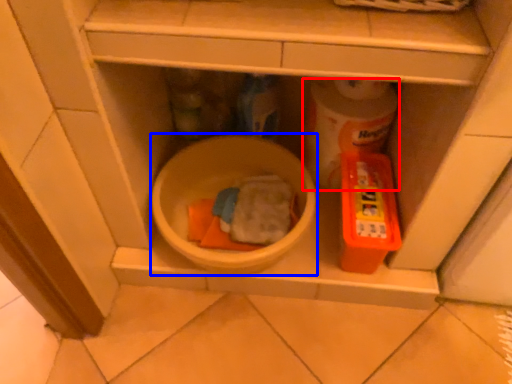
Question: Among these objects, which one is nearest to the camera, toilet paper (highlighted by a red box) or mixing bowl (highlighted by a blue box)?

Choices:
 (A) toilet paper
 (B) mixing bowl

Answer: (B)